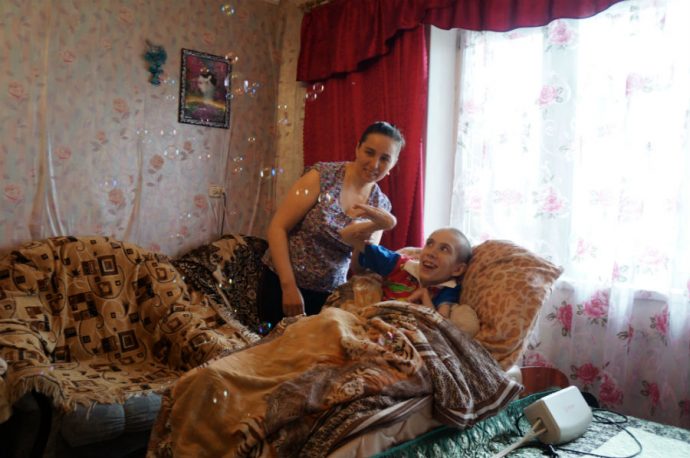
This screenshot has width=690, height=458. Find the location of `electrical cord`. electrical cord is located at coordinates (533, 426), (601, 421).